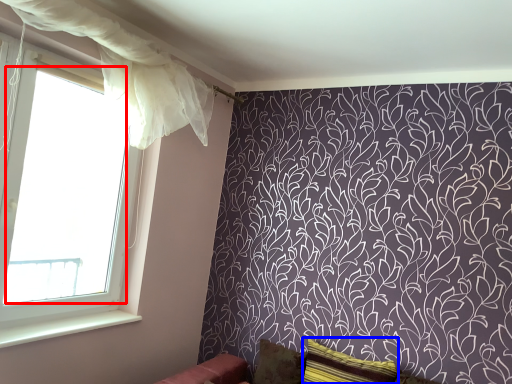
Question: Among these objects, which one is nearest to the camera, window screen (highlighted by a red box) or pillow (highlighted by a blue box)?

Choices:
 (A) window screen
 (B) pillow

Answer: (A)